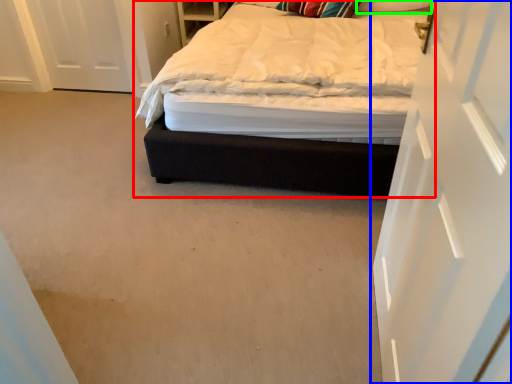
Question: Considering the real-world distances, which object is closest to bed (highlighted by a red box)? door (highlighted by a blue box) or pillow (highlighted by a green box).

Choices:
 (A) door
 (B) pillow

Answer: (A)